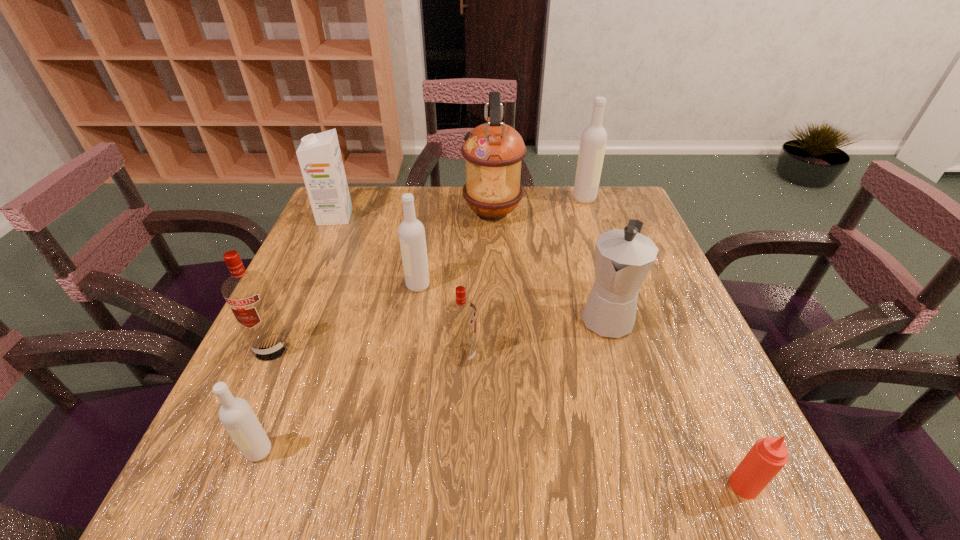
Where is `free space at the far right corner of the desktop`? free space at the far right corner of the desktop is located at coordinates (618, 210).

Find the location of a particular element. This screenshot has width=960, height=540. free space between the carton and the second vodka from right to left is located at coordinates (399, 286).

At what (x,y) coordinates should I click in order to perform the action: click on free space between the fourth vodka from left to right and the oil lamp. Please return your answer as a coordinate pair (x, y). Looking at the image, I should click on 478,285.

Identify the location of empty space that is in between the fourth nearest vodka and the coffeepot. Image resolution: width=960 pixels, height=540 pixels. (512, 301).

Identify the location of vacant area that lies between the oil lamp and the left red vodka. (382, 280).

I want to click on vacant point located between the coffeepot and the rightmost object, so click(x=675, y=401).

Locate an element on the screen. The image size is (960, 540). empty location between the oil lamp and the bigger red vodka is located at coordinates (382, 280).

Locate an element on the screen. The height and width of the screenshot is (540, 960). free space between the oil lamp and the coffeepot is located at coordinates (549, 265).

Identify the location of free space between the smallest white vodka and the bigger red vodka. Image resolution: width=960 pixels, height=540 pixels. click(x=266, y=400).

You are a GUI agent. You are given a task and a screenshot of the screen. Output one action in this format:
    pyautogui.click(x=<x>, y=<y>)
    Task: Click on the free space between the second white vodka from right to left and the carton
    This screenshot has height=540, width=960.
    Given the screenshot: What is the action you would take?
    pyautogui.click(x=376, y=251)